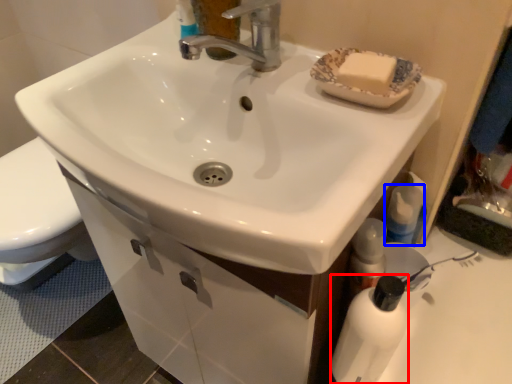
Question: Which point is closer to the camera, bottle (highlighted by a red box) or mouthwash (highlighted by a blue box)?

Choices:
 (A) bottle
 (B) mouthwash

Answer: (A)